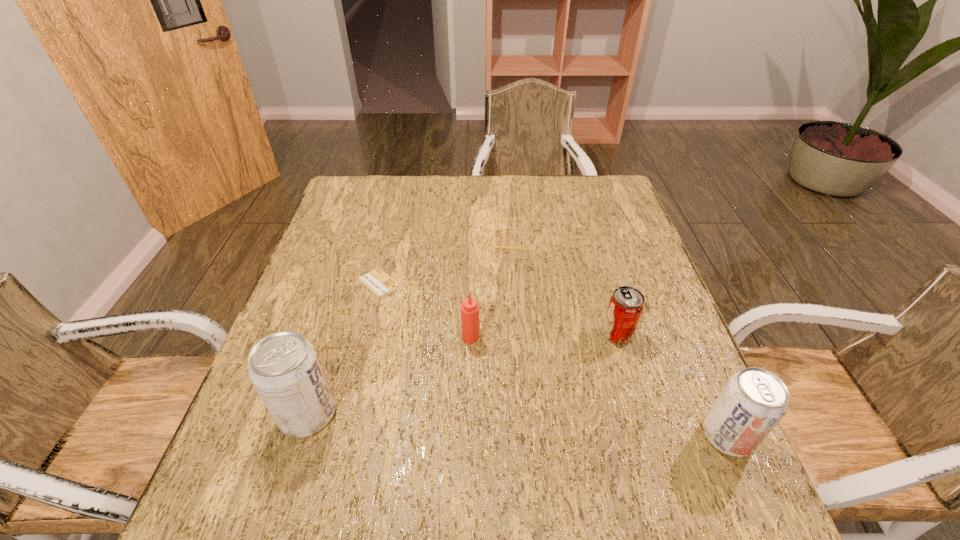
Please determine a free point for an extra pop_(soda) to ensure balance. Please provide its 2D coordinates. Your answer should be formatted as a tuple, i.e. [(x, y)], where the tuple contains the x and y coordinates of a point satisfying the conditions above.

[(514, 424)]